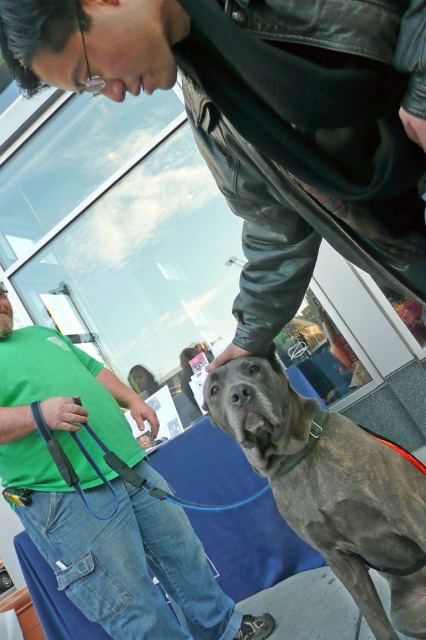
Question: Where is leather jacket at upper center located in relation to green cotton shirt at lower left in the image?

Choices:
 (A) below
 (B) above

Answer: (B)

Question: Which point is closer to the camera taking this photo?

Choices:
 (A) (311, 524)
 (B) (51, 420)
 (C) (276, 474)

Answer: (A)

Question: In this image, where is green cotton shirt at lower left located relative to blue fabric leash at center?

Choices:
 (A) below
 (B) above

Answer: (A)

Question: Which point appears closest to the camera in this image?

Choices:
 (A) (319, 419)
 (B) (330, 536)

Answer: (B)

Question: Which of these objects is positioned closest to the gray brindle dog at center?

Choices:
 (A) green fabric neckband at center
 (B) green cotton shirt at lower left
 (C) leather jacket at upper center
 (D) blue fabric leash at center

Answer: (A)

Question: Does gray brindle dog at center appear on the left side of green fabric neckband at center?

Choices:
 (A) yes
 (B) no

Answer: (B)